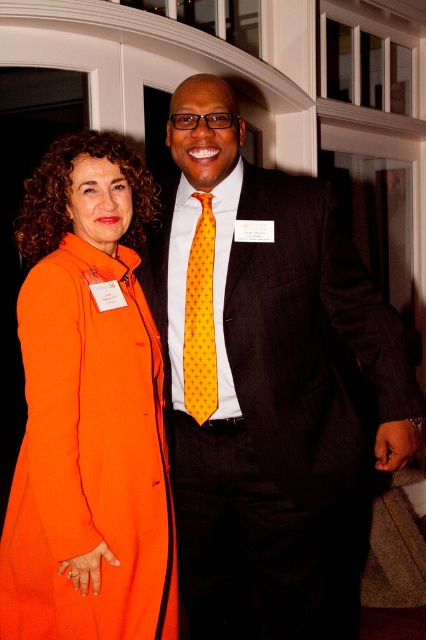
Question: Which object is closer to the camera taking this photo?

Choices:
 (A) matte black suit at center
 (B) yellow dotted tie at center
 (C) orange fabric coat at left

Answer: (C)

Question: Can you confirm if orange fabric coat at left is wider than yellow dotted tie at center?

Choices:
 (A) no
 (B) yes

Answer: (B)

Question: Is matte black suit at center to the left of yellow dotted tie at center from the viewer's perspective?

Choices:
 (A) no
 (B) yes

Answer: (A)

Question: Which object appears farthest from the camera in this image?

Choices:
 (A) orange fabric coat at left
 (B) matte black suit at center

Answer: (B)

Question: Does matte black suit at center have a smaller size compared to yellow dotted tie at center?

Choices:
 (A) no
 (B) yes

Answer: (A)

Question: Which object appears farthest from the camera in this image?

Choices:
 (A) yellow dotted tie at center
 (B) orange fabric coat at left
 (C) matte black suit at center

Answer: (A)